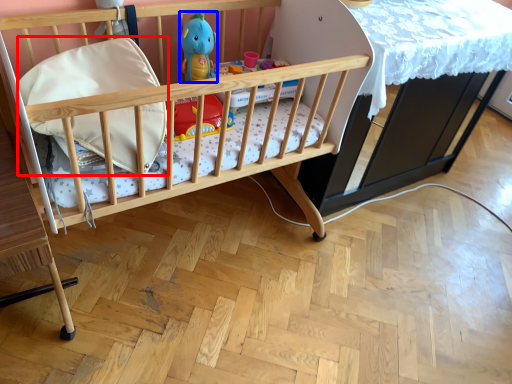
Question: Which object appears farthest to the camera in this image, pillow (highlighted by a red box) or toy (highlighted by a blue box)?

Choices:
 (A) pillow
 (B) toy

Answer: (B)